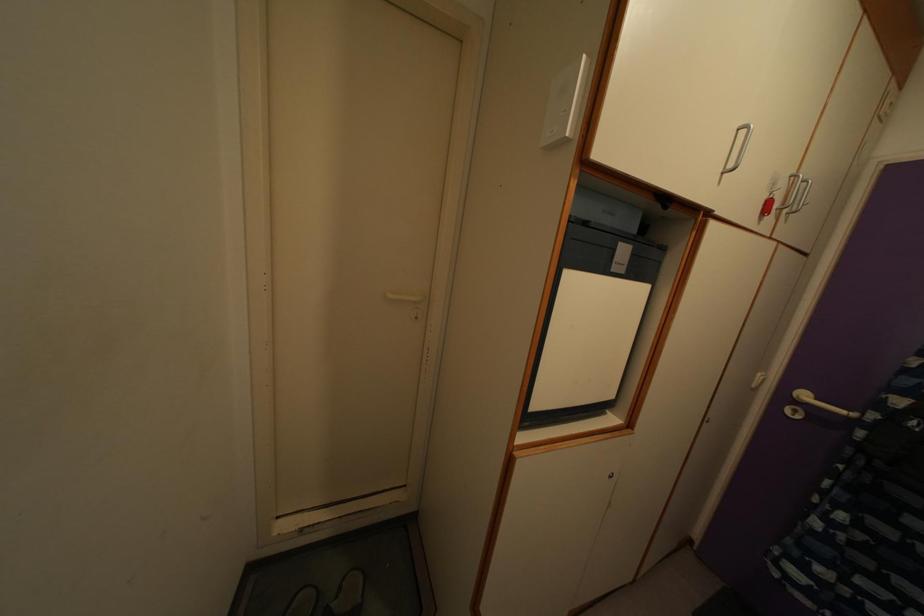
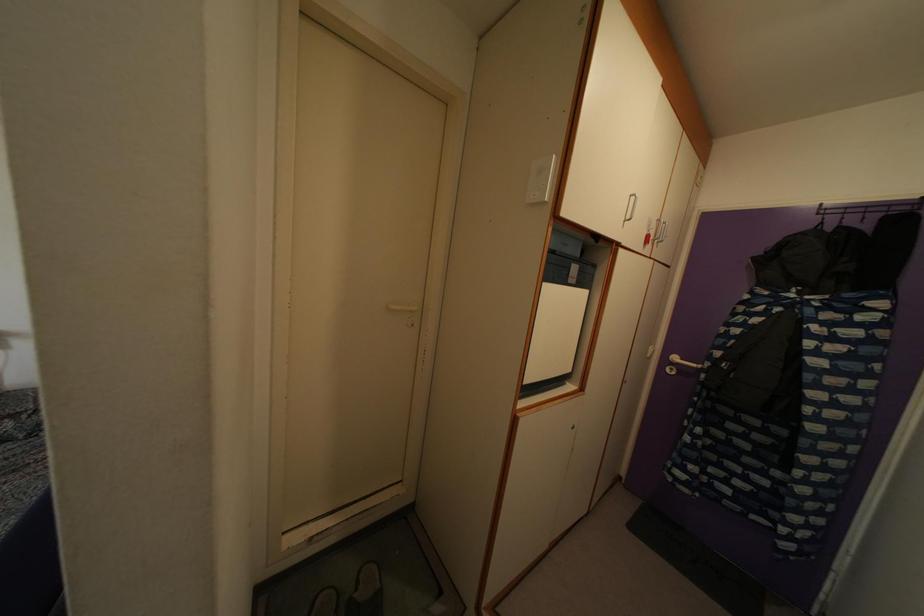
Locate, in the second image, the point that corresponds to [346,586] in the first image.

(361, 581)